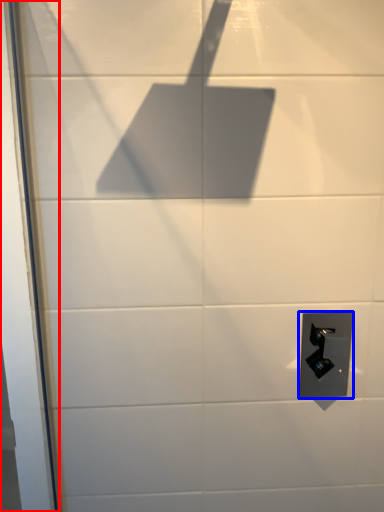
Question: Which of the following is the closest to the observer, screen door (highlighted by a red box) or door handle (highlighted by a blue box)?

Choices:
 (A) screen door
 (B) door handle

Answer: (A)